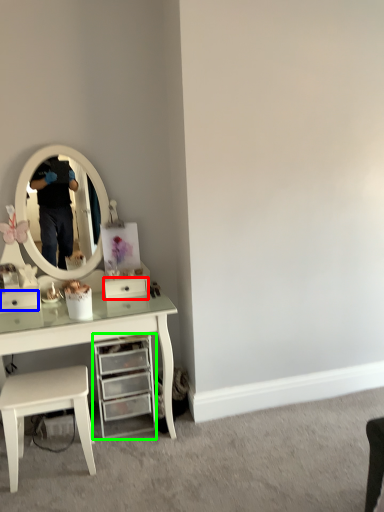
Question: Which object is the closest to the drawer (highlighted by a red box)? Choose among these: drawer (highlighted by a blue box) or chest of drawers (highlighted by a green box).

Choices:
 (A) drawer
 (B) chest of drawers

Answer: (B)